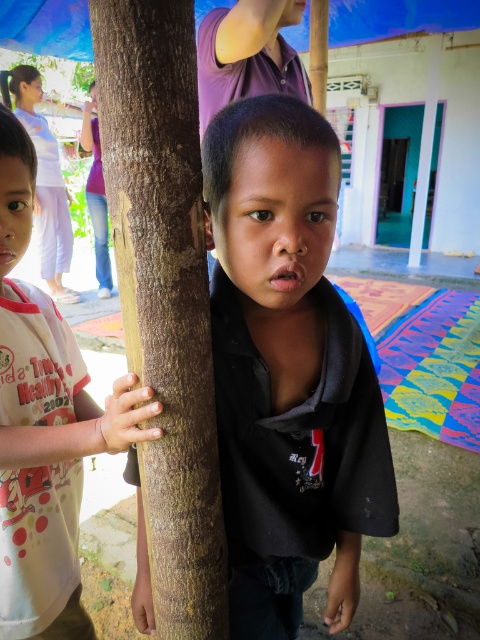
You are a photographer standing at the center of the scene. You want to take a photo of the black matte shirt at center. Where should you point your camera to capture it?

You should point your camera towards the coordinates at point (288, 371) to capture the black matte shirt at center.

You are standing at the point with coordinates [288,371] in the image. What object is directly beneath your feet?

The point at [288,371] is located on the black matte shirt at center, so the object directly beneath your feet is the black matte shirt at center.

You are a photographer trying to capture both the brown rough tree trunk at center and the light pink fabric shirt at left in the same frame. Based on their positions, which object is higher in the image?

The brown rough tree trunk at center is located above the light pink fabric shirt at left, so it is higher in the image.